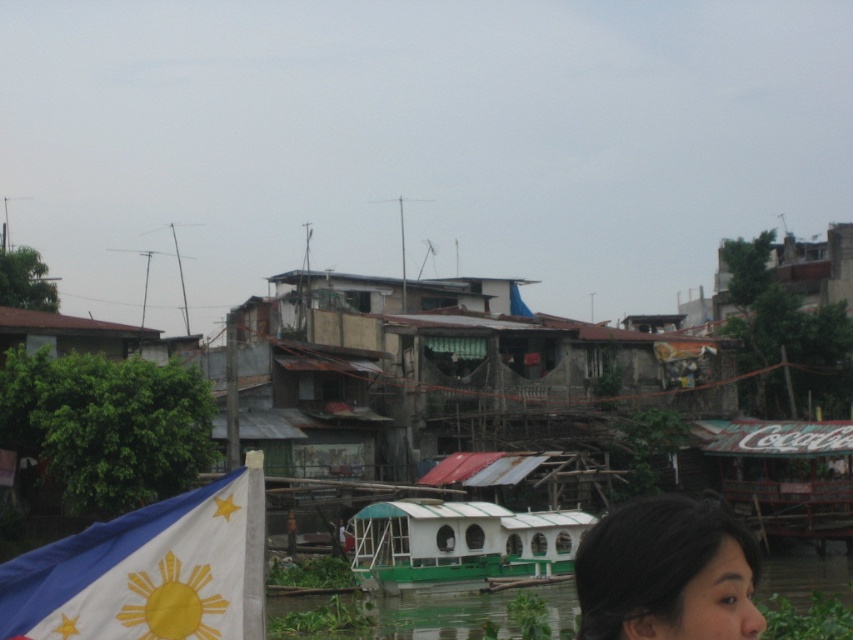
How far apart are white fabric flag at lower left and dark brown hair at lower right?

white fabric flag at lower left is 29.46 feet from dark brown hair at lower right.

Is the position of white fabric flag at lower left less distant than that of dark brown hair at lower right?

No.

I want to click on white fabric flag at lower left, so 149,572.

Who is more forward, (643, 547) or (503, 561)?

Positioned in front is point (643, 547).

From the picture: Between dark brown hair at lower right and green matte boat at center, which one has more height?

dark brown hair at lower right is taller.

Who is more forward, (x=711, y=588) or (x=517, y=564)?

Positioned in front is point (x=711, y=588).

Where is `dark brown hair at lower right`? This screenshot has height=640, width=853. dark brown hair at lower right is located at coordinates (666, 573).

Between white fabric flag at lower left and green matte boat at center, which one is positioned higher?

Positioned higher is white fabric flag at lower left.

Is white fabric flag at lower left further to camera compared to green matte boat at center?

That is False.

Identify the location of white fabric flag at lower left. This screenshot has width=853, height=640. click(x=149, y=572).